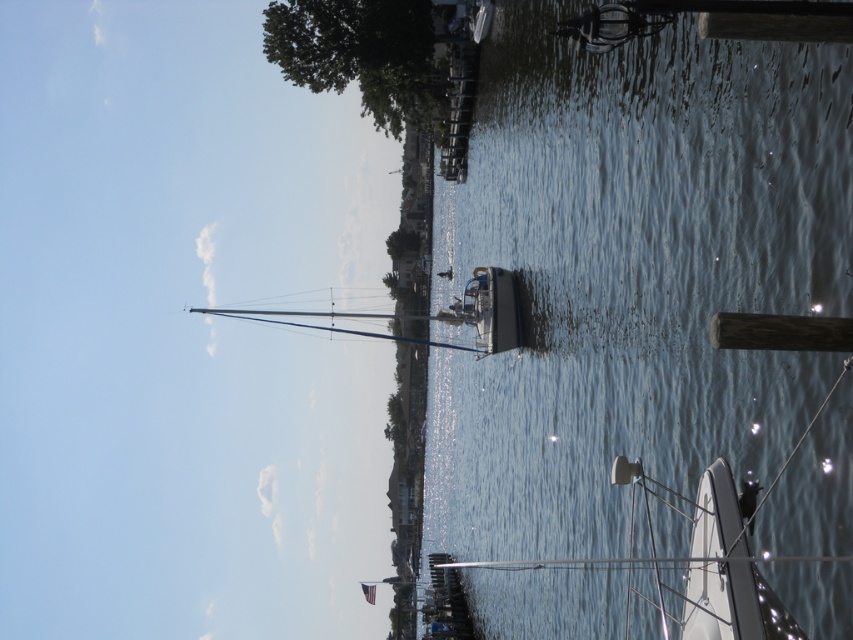
You are planning to take a photo of the waterfront scene. You want to ensure that both the clear water at center and the white glossy sailboat at lower right are visible in the frame. Given their sizes, which object should you focus on to include both in the composition?

The clear water at center has a larger size compared to the white glossy sailboat at lower right. To include both in the composition, focus on the larger clear water at center and position it to allow the smaller sailboat to be captured within the frame.

You are standing on the dock and see two points in the image. Which point is closer to you, point (442, 513) or point (349, 12)?

Point (442, 513) is further to the viewer than point (349, 12), so point (349, 12) is closer to you.